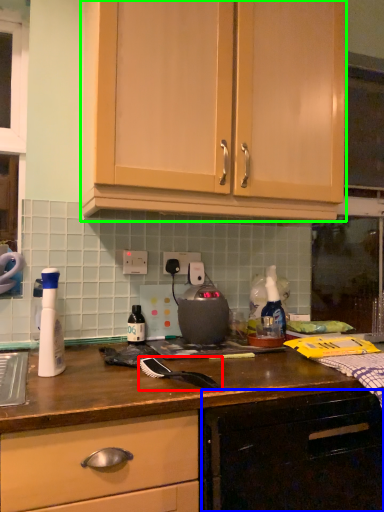
Question: Estimate the real-world distances between objects in this image. Which object is closer to brush (highlighted by a red box), cabinetry (highlighted by a blue box) or cabinetry (highlighted by a green box)?

Choices:
 (A) cabinetry
 (B) cabinetry

Answer: (A)